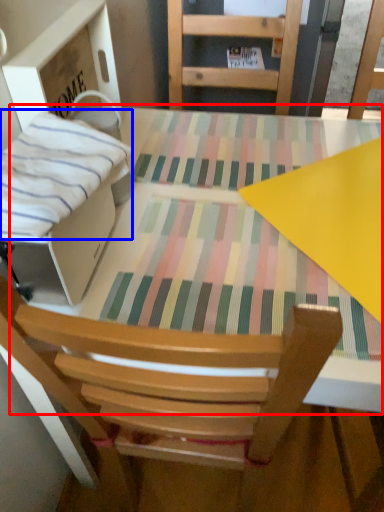
Question: Which point is further to the camera, round table (highlighted by a red box) or blanket (highlighted by a blue box)?

Choices:
 (A) round table
 (B) blanket

Answer: (A)